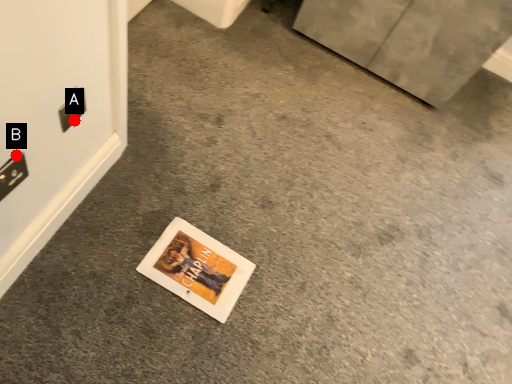
Question: Two points are circled on the image, labeled by A and B beside each circle. Among these points, which one is farthest from the camera?

Choices:
 (A) A is further
 (B) B is further

Answer: (A)